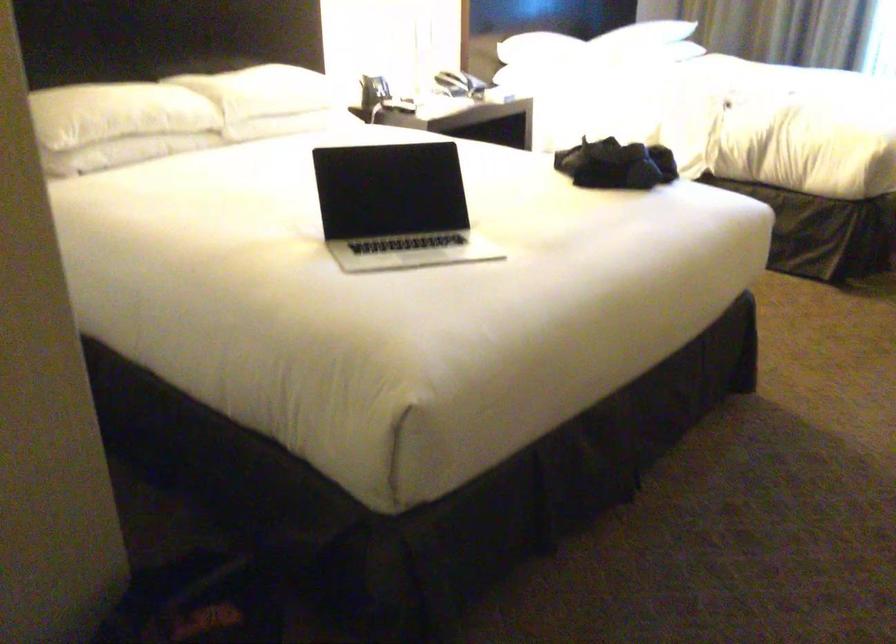
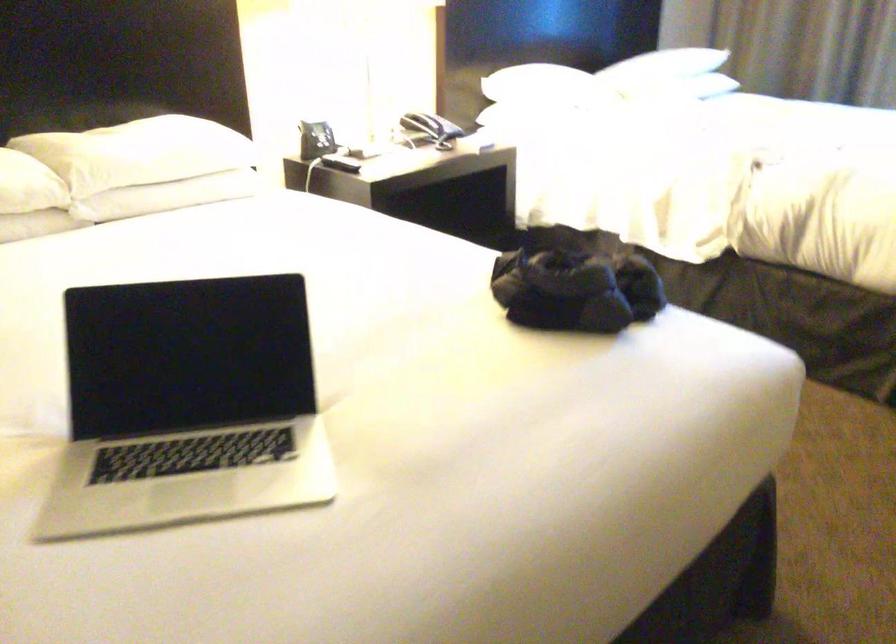
Question: The first image is from the beginning of the video and the second image is from the end. How did the camera likely rotate when shooting the video?

Choices:
 (A) Left
 (B) Right
 (C) Up
 (D) Down

Answer: (A)